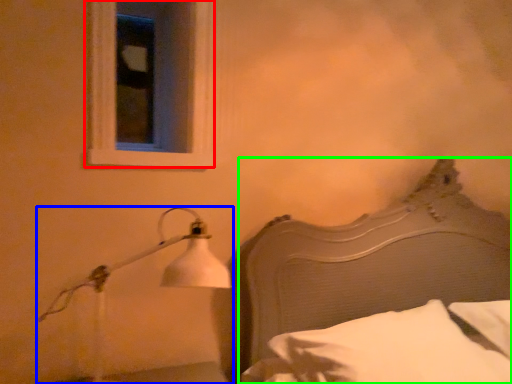
Question: Considering the real-world distances, which object is closest to window (highlighted by a red box)? lamp (highlighted by a blue box) or bed (highlighted by a green box).

Choices:
 (A) lamp
 (B) bed

Answer: (A)